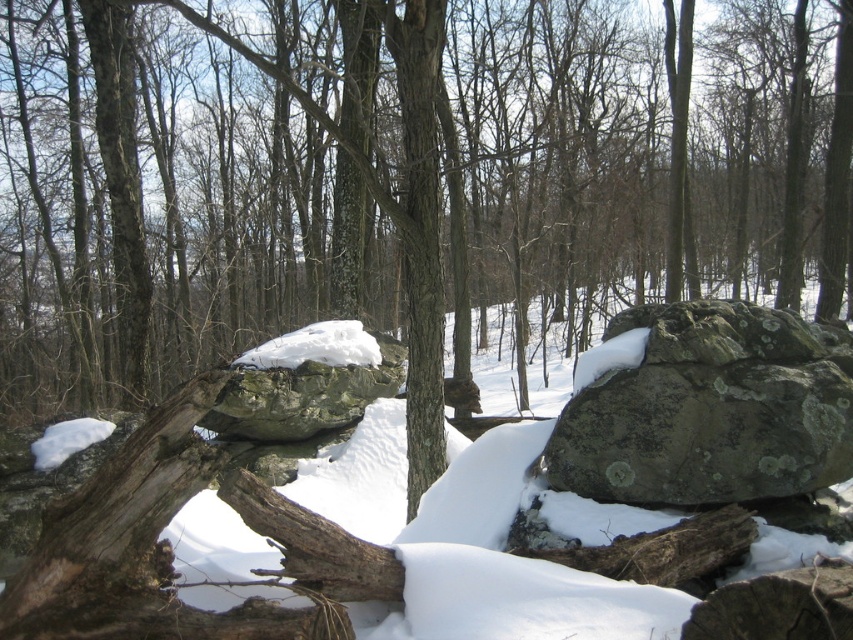
Does white powdery snow at center appear on the right side of lichen-covered rock at center-right?

In fact, white powdery snow at center is to the left of lichen-covered rock at center-right.

Which is below, white powdery snow at center or lichen-covered rock at center-right?

white powdery snow at center is lower down.

In order to click on white powdery snow at center in this screenshot , I will do (x=440, y=486).

This screenshot has width=853, height=640. I want to click on white powdery snow at center, so click(x=440, y=486).